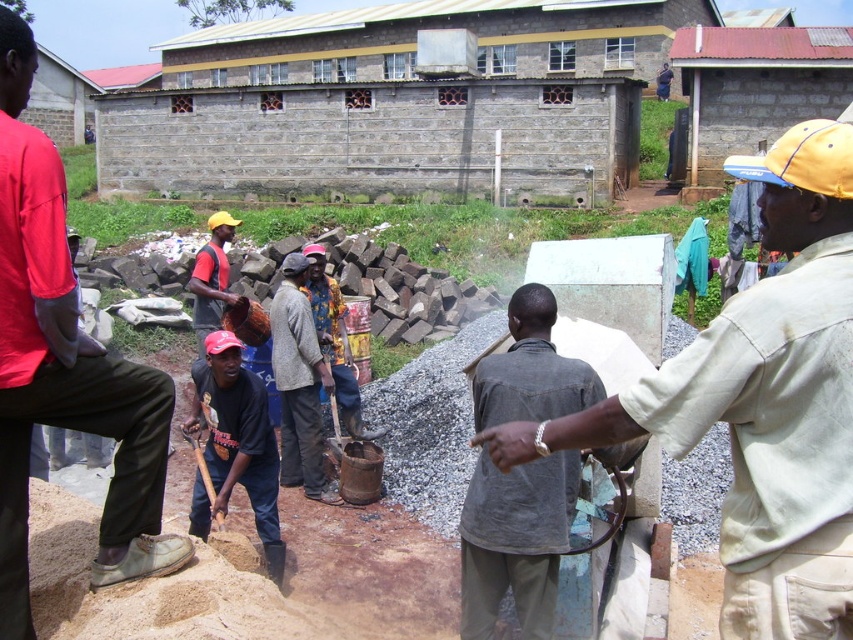
Which is behind, point (32, 269) or point (318, 244)?

Positioned behind is point (318, 244).

Is red shirt at left bigger than printed fabric shirt at center?

Actually, red shirt at left might be smaller than printed fabric shirt at center.

The image size is (853, 640). What are the coordinates of `red shirt at left` in the screenshot? It's located at (64, 364).

Find the location of a particular element. Image resolution: width=853 pixels, height=640 pixels. red shirt at left is located at coordinates pyautogui.click(x=64, y=364).

Is dark gray shirt at center taller than flannel shirt at center?

In fact, dark gray shirt at center may be shorter than flannel shirt at center.

Which of these two, dark gray shirt at center or flannel shirt at center, stands shorter?

Standing shorter between the two is dark gray shirt at center.

Who is more distant from viewer, (480, 627) or (310, 465)?

Positioned behind is point (310, 465).

You are a GUI agent. You are given a task and a screenshot of the screen. Output one action in this format:
    pyautogui.click(x=<x>, y=<y>)
    Task: Click on the dark gray shirt at center
    This screenshot has width=853, height=640.
    Given the screenshot: What is the action you would take?
    pyautogui.click(x=515, y=541)

Does dark blue shirt at center have a lesser height compared to flannel shirt at center?

Yes, dark blue shirt at center is shorter than flannel shirt at center.

Between dark blue shirt at center and flannel shirt at center, which one appears on the left side from the viewer's perspective?

Positioned to the left is dark blue shirt at center.

Where is `dark blue shirt at center`? The width and height of the screenshot is (853, 640). dark blue shirt at center is located at coordinates (235, 444).